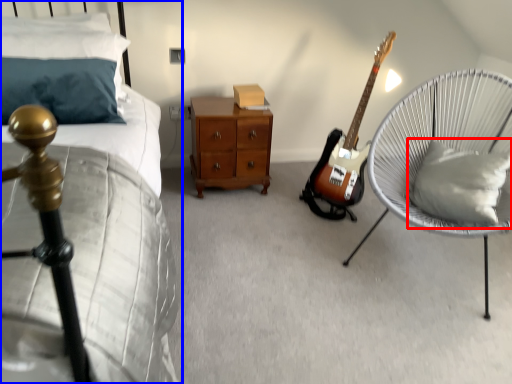
Question: Which of the following is the closest to the observer, pillow (highlighted by a red box) or bed (highlighted by a blue box)?

Choices:
 (A) pillow
 (B) bed

Answer: (B)